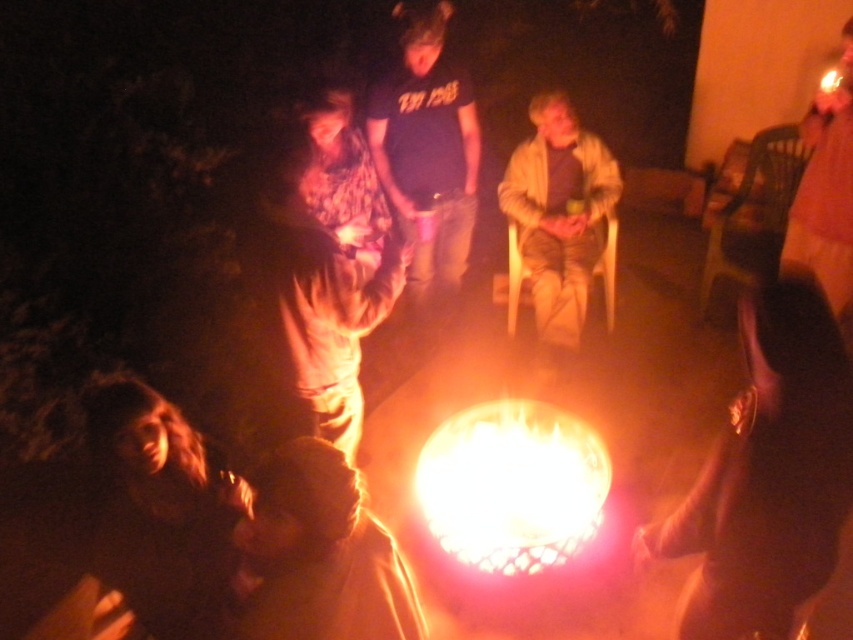
In the scene shown: You are standing in front of the campfire and want to reach both the point at coordinate (598, 250) and the point at coordinate (807, 125). Which point is closer to you?

The point at coordinate (598, 250) is closer to you because it is further to the camera than the other point, meaning it is nearer in the scene.